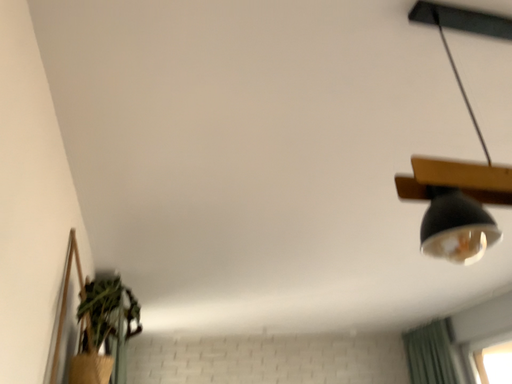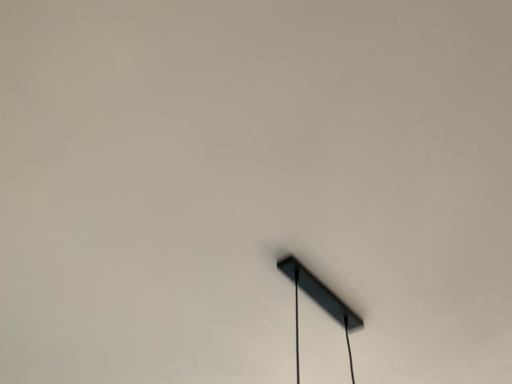
Question: How did the camera likely rotate when shooting the video?

Choices:
 (A) rotated left
 (B) rotated right

Answer: (B)